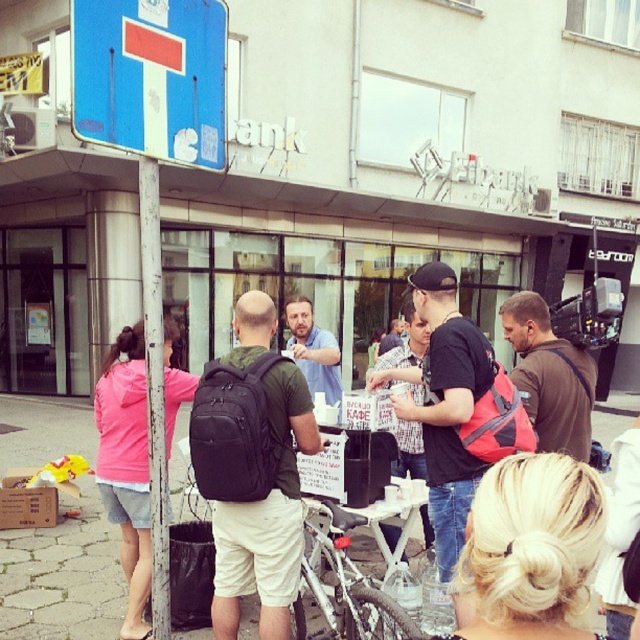
Question: Which object appears closest to the camera in this image?

Choices:
 (A) matte black backpack at center
 (B) blue painted metal sign at upper left

Answer: (B)

Question: Which object is closer to the camera taking this photo?

Choices:
 (A) brown fabric backpack at center-right
 (B) matte black backpack at center

Answer: (B)

Question: Is matte black backpack at center below plaid shirt at center?

Choices:
 (A) yes
 (B) no

Answer: (B)

Question: Is black matte backpack at center in front of matte blue shirt at center?

Choices:
 (A) yes
 (B) no

Answer: (A)

Question: Among these points, which one is farthest from the camera?

Choices:
 (A) (227, 572)
 (B) (445, 454)
 (C) (410, 336)

Answer: (C)

Question: Is blue painted metal sign at upper left positioned behind brown fabric backpack at center-right?

Choices:
 (A) no
 (B) yes

Answer: (A)